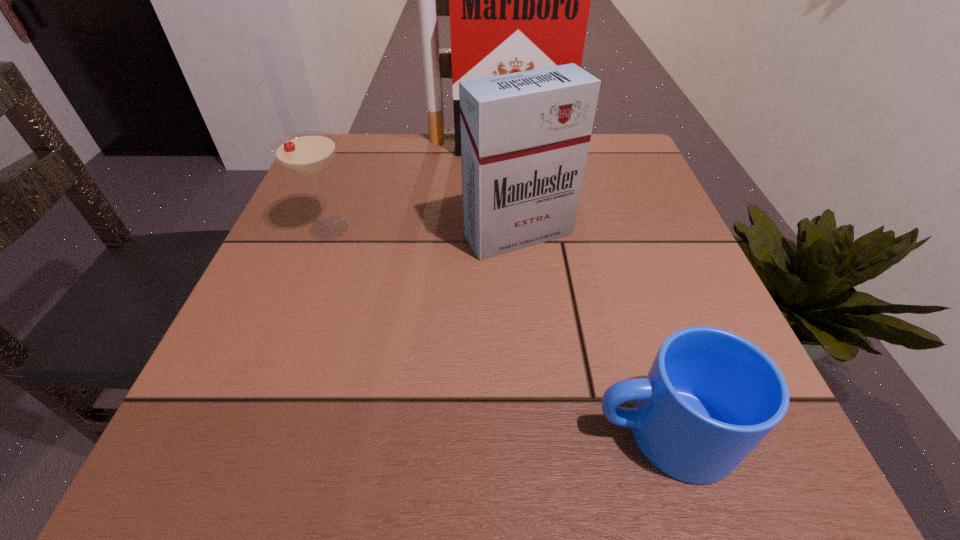
The image size is (960, 540). Find the location of `the farther cigarette case`. the farther cigarette case is located at coordinates (519, 0).

At what (x,y) coordinates should I click in order to perform the action: click on the farthest object. Please return your answer as a coordinate pair (x, y). The image size is (960, 540). Looking at the image, I should click on (519, 0).

The height and width of the screenshot is (540, 960). Identify the location of the shorter cigarette case. (525, 136).

The width and height of the screenshot is (960, 540). Find the location of `the second tallest object`. the second tallest object is located at coordinates click(x=525, y=136).

This screenshot has width=960, height=540. Find the location of `the leftmost object`. the leftmost object is located at coordinates (308, 153).

In order to click on martini in this screenshot , I will do `click(308, 153)`.

You are a GUI agent. You are given a task and a screenshot of the screen. Output one action in this format:
    pyautogui.click(x=<x>, y=<y>)
    Task: Click on the nearest object
    The height and width of the screenshot is (540, 960).
    Given the screenshot: What is the action you would take?
    pyautogui.click(x=711, y=396)

Find the location of a particular element. the shortest object is located at coordinates (711, 396).

Identify the location of free location located 0.170m on the front-facing side of the taller cigarette case. The width and height of the screenshot is (960, 540). (499, 199).

You are a GUI agent. You are given a task and a screenshot of the screen. Output one action in this format:
    pyautogui.click(x=<x>, y=<y>)
    Task: Click on the vacant position located 0.300m on the back of the second tallest object
    The height and width of the screenshot is (540, 960).
    Given the screenshot: What is the action you would take?
    pyautogui.click(x=509, y=138)